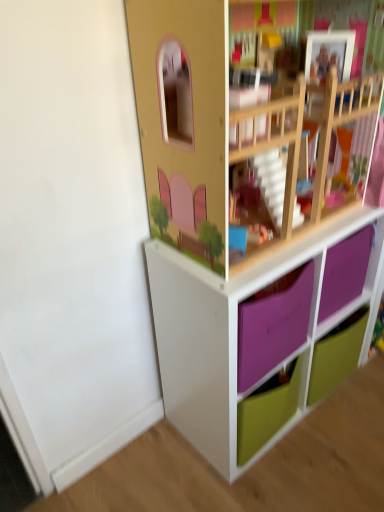
Question: Should I look upward or downward to see white matte storage unit at lower right?

Choices:
 (A) up
 (B) down

Answer: (B)

Question: From a real-world perspective, is white matte storage unit at lower right physically below green matte drawer at lower right?

Choices:
 (A) no
 (B) yes

Answer: (A)

Question: From the image's perspective, is white matte storage unit at lower right under green matte drawer at lower right?

Choices:
 (A) no
 (B) yes

Answer: (A)

Question: Is the depth of white matte storage unit at lower right greater than that of green matte drawer at lower right?

Choices:
 (A) no
 (B) yes

Answer: (A)

Question: Would you say white matte storage unit at lower right is a long distance from green matte drawer at lower right?

Choices:
 (A) no
 (B) yes

Answer: (A)

Question: From the image's perspective, is white matte storage unit at lower right located above green matte drawer at lower right?

Choices:
 (A) no
 (B) yes

Answer: (B)

Question: Is white matte storage unit at lower right closer to the viewer compared to green matte drawer at lower right?

Choices:
 (A) no
 (B) yes

Answer: (B)

Question: From the image's perspective, would you say green matte drawer at lower right is shown under white matte storage unit at lower right?

Choices:
 (A) yes
 (B) no

Answer: (A)

Question: Does green matte drawer at lower right have a larger size compared to white matte storage unit at lower right?

Choices:
 (A) yes
 (B) no

Answer: (B)

Question: Does green matte drawer at lower right have a greater height compared to white matte storage unit at lower right?

Choices:
 (A) no
 (B) yes

Answer: (A)

Question: Is green matte drawer at lower right positioned in front of white matte storage unit at lower right?

Choices:
 (A) yes
 (B) no

Answer: (B)

Question: Does green matte drawer at lower right touch white matte storage unit at lower right?

Choices:
 (A) yes
 (B) no

Answer: (B)

Question: Is green matte drawer at lower right oriented towards white matte storage unit at lower right?

Choices:
 (A) no
 (B) yes

Answer: (B)

Question: From a real-world perspective, is green matte drawer at lower right above or below white matte storage unit at lower right?

Choices:
 (A) below
 (B) above

Answer: (A)